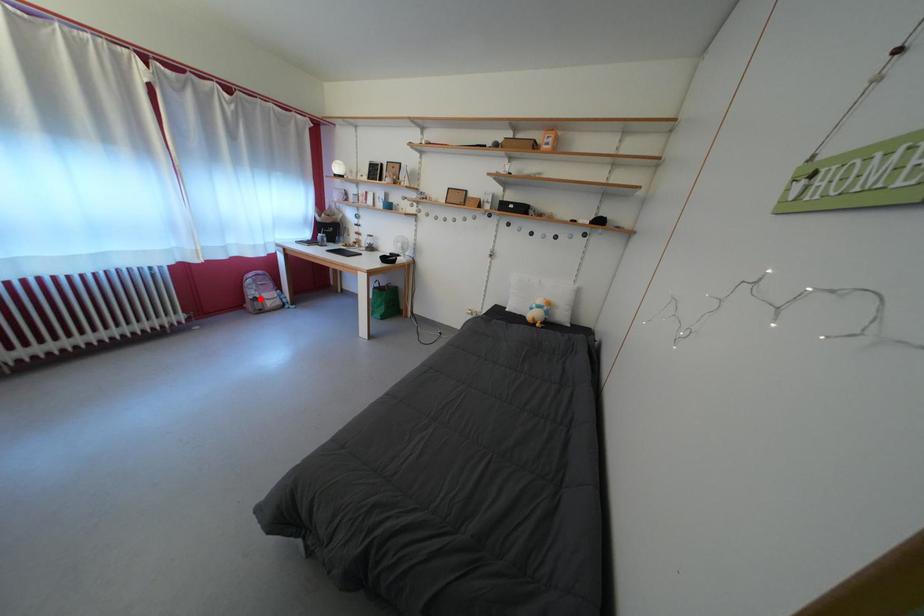
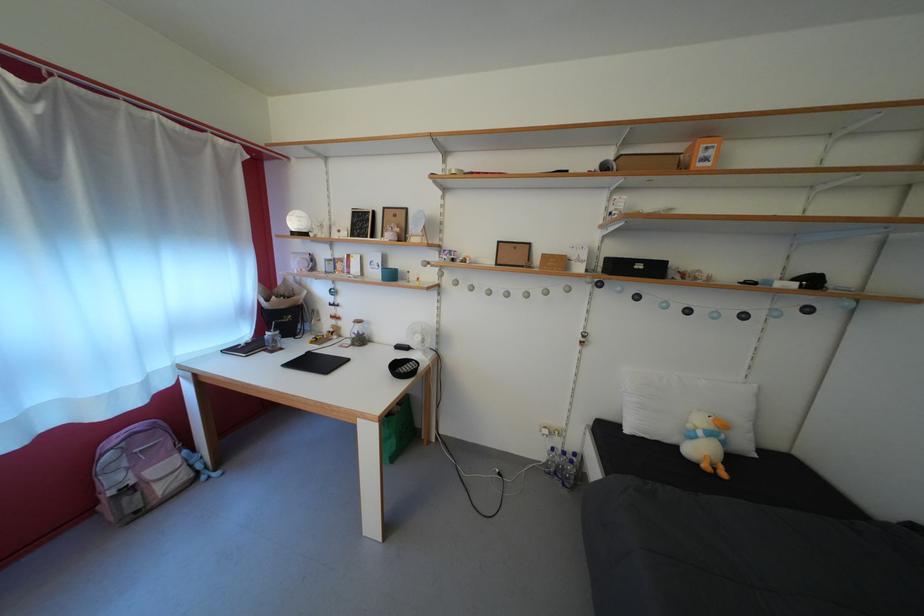
Question: I am providing you with two images of the same scene from different viewpoints. A red point is shown in image1. For the corresponding object point in image2, is it positioned nearer or farther from the camera?

Choices:
 (A) Nearer
 (B) Farther

Answer: (B)